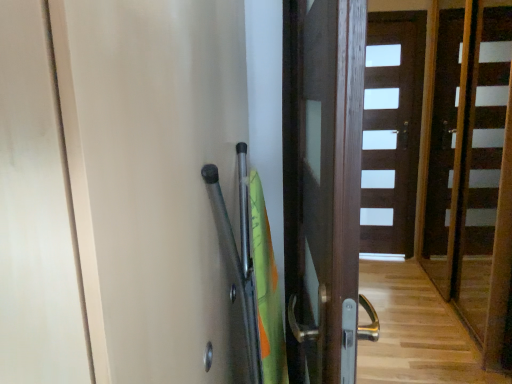
Question: Is brown wooden door at center, the 1th door in the back-to-front sequence, further to camera compared to wooden stairs at center?

Choices:
 (A) yes
 (B) no

Answer: (A)

Question: From the image's perspective, would you say brown wooden door at center, the 2th door positioned from the front, is positioned over wooden stairs at center?

Choices:
 (A) yes
 (B) no

Answer: (A)

Question: Is brown wooden door at center, the 1th door in the back-to-front sequence, not inside wooden stairs at center?

Choices:
 (A) no
 (B) yes

Answer: (B)

Question: Is brown wooden door at center, which is the first door in right-to-left order, wider than wooden stairs at center?

Choices:
 (A) no
 (B) yes

Answer: (A)

Question: Is brown wooden door at center, which is the first door in right-to-left order, positioned in front of wooden stairs at center?

Choices:
 (A) yes
 (B) no

Answer: (B)

Question: From a real-world perspective, is brown wooden door at center, which ranks as the second door in left-to-right order, positioned over wooden stairs at center based on gravity?

Choices:
 (A) no
 (B) yes

Answer: (A)

Question: Considering the relative positions of brown wooden door at center, the 1th door in the back-to-front sequence, and transparent plastic screen door at upper right in the image provided, is brown wooden door at center, the 1th door in the back-to-front sequence, to the right of transparent plastic screen door at upper right from the viewer's perspective?

Choices:
 (A) yes
 (B) no

Answer: (A)

Question: From the image's perspective, does brown wooden door at center, which is the first door in right-to-left order, appear higher than transparent plastic screen door at upper right?

Choices:
 (A) no
 (B) yes

Answer: (B)

Question: Is brown wooden door at center, the 2th door positioned from the front, in contact with transparent plastic screen door at upper right?

Choices:
 (A) yes
 (B) no

Answer: (B)

Question: Is brown wooden door at center, which ranks as the second door in left-to-right order, aimed at transparent plastic screen door at upper right?

Choices:
 (A) no
 (B) yes

Answer: (A)

Question: Considering the relative positions of brown wooden door at center, the 1th door in the back-to-front sequence, and transparent plastic screen door at upper right in the image provided, is brown wooden door at center, the 1th door in the back-to-front sequence, behind transparent plastic screen door at upper right?

Choices:
 (A) yes
 (B) no

Answer: (A)

Question: Is brown wooden door at center, which is the first door in right-to-left order, shorter than transparent plastic screen door at upper right?

Choices:
 (A) yes
 (B) no

Answer: (B)

Question: From a real-world perspective, does dark wood door at center, arranged as the first door when viewed from the left, stand above brown wooden door at center, which is the first door in right-to-left order?

Choices:
 (A) yes
 (B) no

Answer: (A)